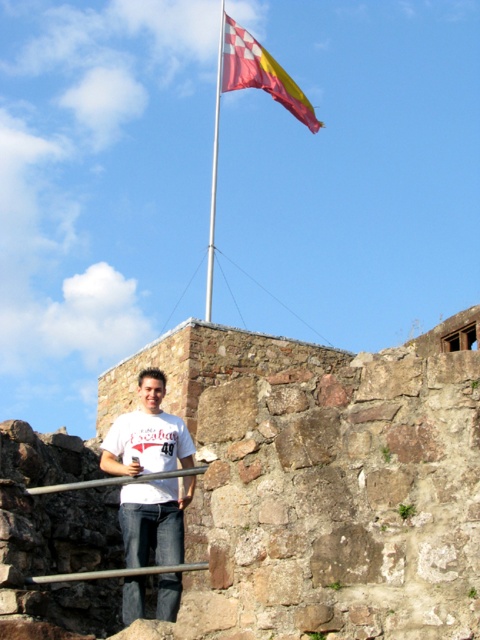
You are a drone operator trying to locate a specific point on the flag pole in the image. The point is marked as point (215, 170). Where exactly on the flag pole is this point located?

The point (215, 170) is located on the white metallic flag pole at upper center.

You are a photographer trying to capture the red and white checkered flag at upper center and the brushed metal rail at lower center in the same frame. Which object should you focus on first if you want to ensure both are in focus without adjusting your camera settings?

The red and white checkered flag at upper center should be focused on first because its width surpasses the brushed metal rail at lower center, making it the larger object. By focusing on the larger object, you can ensure both are within the depth of field without needing to adjust settings.

You are a photographer trying to capture the red and white checkered flag at upper center and the brushed metal rail at lower center in the same frame. Based on their positions, which object should appear higher in your photo?

The red and white checkered flag at upper center should appear higher in the photo since it is positioned above the brushed metal rail at lower center.